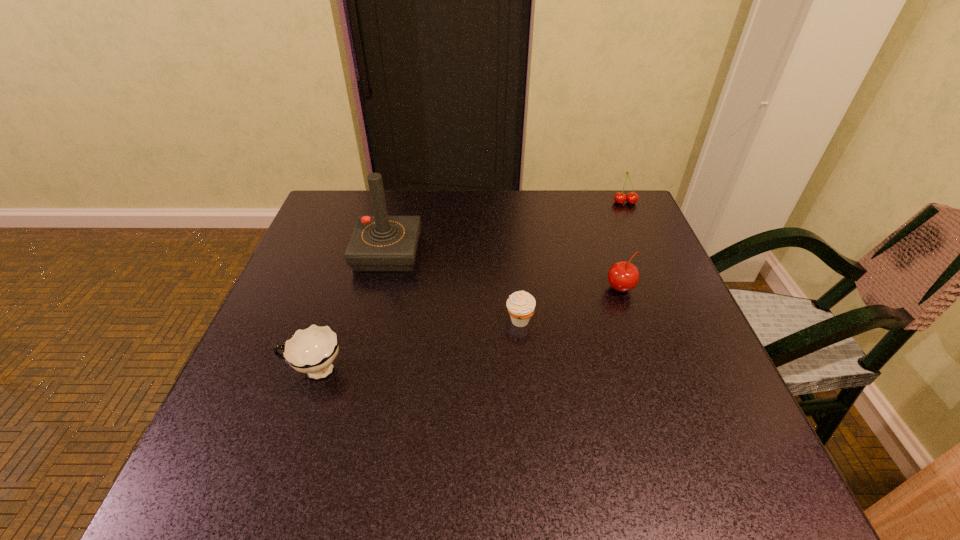
Find the location of a particular element. This screenshot has width=960, height=540. vacant space positioned 0.220m with the stems of the farther cherry pointing upwards is located at coordinates (649, 255).

Find the location of a particular element. The width and height of the screenshot is (960, 540). vacant region located 0.320m on the left of the third farthest object is located at coordinates (465, 288).

Identify the location of vacant space located 0.120m on the right of the muffin. Image resolution: width=960 pixels, height=540 pixels. (590, 320).

Where is `free space located 0.050m on the side of the cup with the handle`? This screenshot has width=960, height=540. free space located 0.050m on the side of the cup with the handle is located at coordinates (255, 370).

Where is `joystick present at the far edge`? joystick present at the far edge is located at coordinates (380, 243).

What are the coordinates of `cherry situated at the far edge` in the screenshot? It's located at (632, 197).

I want to click on joystick that is at the left edge, so click(380, 243).

The image size is (960, 540). Find the location of `cup that is at the left edge`. cup that is at the left edge is located at coordinates (312, 350).

You are a GUI agent. You are given a task and a screenshot of the screen. Output one action in this format:
    pyautogui.click(x=<x>, y=<y>)
    Task: Click on the object that is at the far left corner
    Image resolution: width=960 pixels, height=540 pixels.
    Given the screenshot: What is the action you would take?
    pyautogui.click(x=380, y=243)

Where is `object present at the far right corner`? This screenshot has width=960, height=540. object present at the far right corner is located at coordinates pyautogui.click(x=632, y=197).